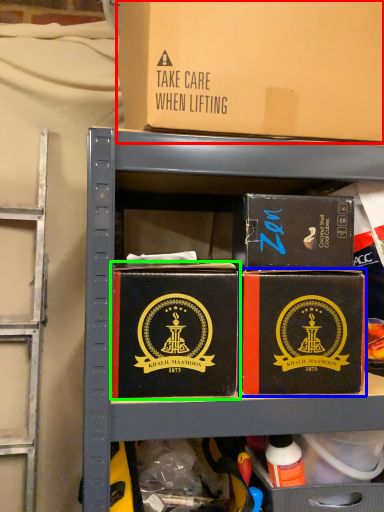
Question: Which object is the farthest from box (highlighted by a red box)? Choose among these: box (highlighted by a blue box) or box (highlighted by a green box).

Choices:
 (A) box
 (B) box

Answer: (B)